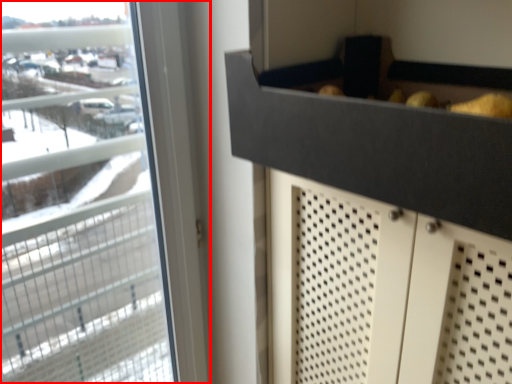
Question: From the image's perspective, what is the correct spatial relationship of window (annotated by the red box) in relation to drawer?

Choices:
 (A) above
 (B) below

Answer: (B)